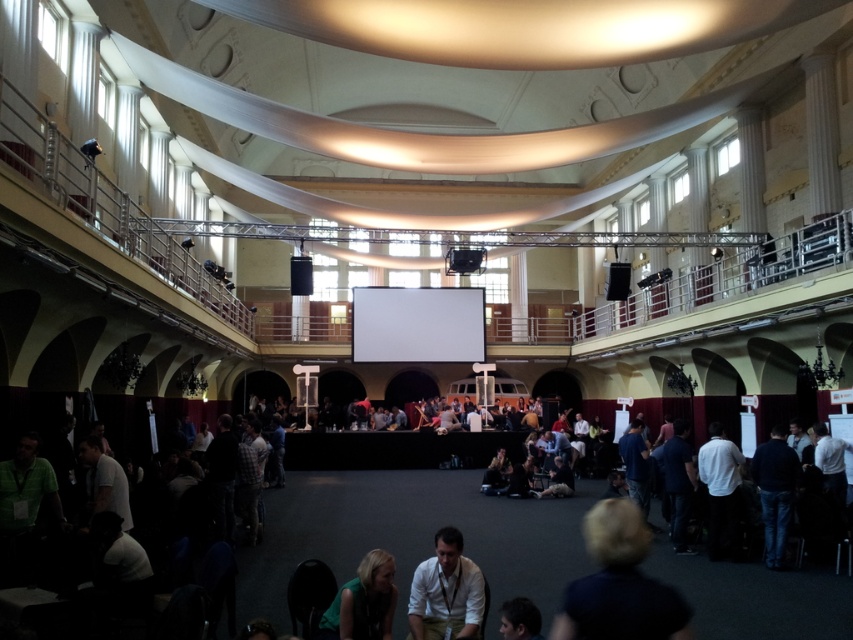
Question: Does white matte shirt at center appear over dark brown hair at lower center?

Choices:
 (A) yes
 (B) no

Answer: (B)

Question: Observing the image, what is the correct spatial positioning of white shirt at lower center in reference to white matte shirt at center?

Choices:
 (A) left
 (B) right

Answer: (A)

Question: Is white shirt at lower center thinner than white matte shirt at center?

Choices:
 (A) yes
 (B) no

Answer: (A)

Question: Which point appears farthest from the camera in this image?

Choices:
 (A) (759, 449)
 (B) (503, 624)

Answer: (A)

Question: Which point is closer to the camera?

Choices:
 (A) white shirt at lower center
 (B) dark blue shirt at center
 (C) blonde hair at lower right
 (D) dark brown hair at lower center

Answer: (C)

Question: Which point is closer to the camera?

Choices:
 (A) white shirt at lower center
 (B) dark blue shirt at center
 (C) white matte shirt at center
 (D) blonde hair at lower right

Answer: (D)